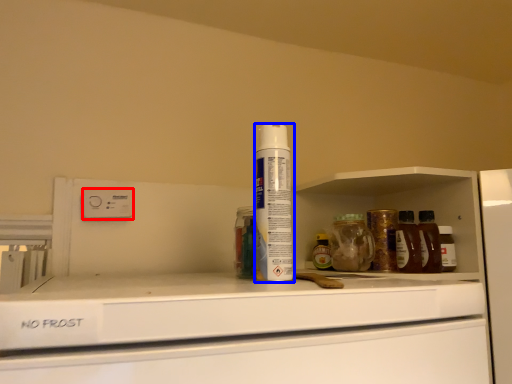
Question: Which object is closer to the camera taking this photo, electric outlet (highlighted by a red box) or shaving cream (highlighted by a blue box)?

Choices:
 (A) electric outlet
 (B) shaving cream

Answer: (B)